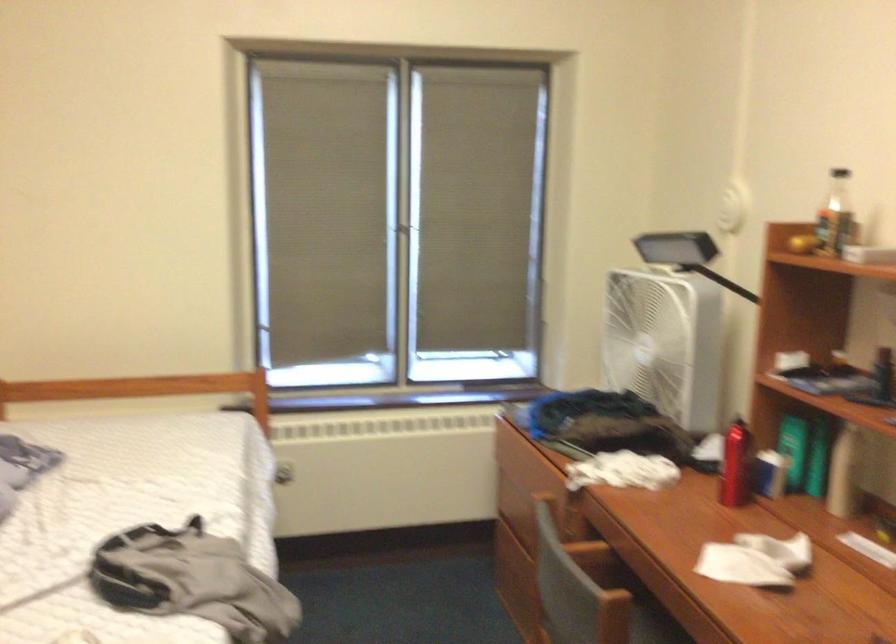
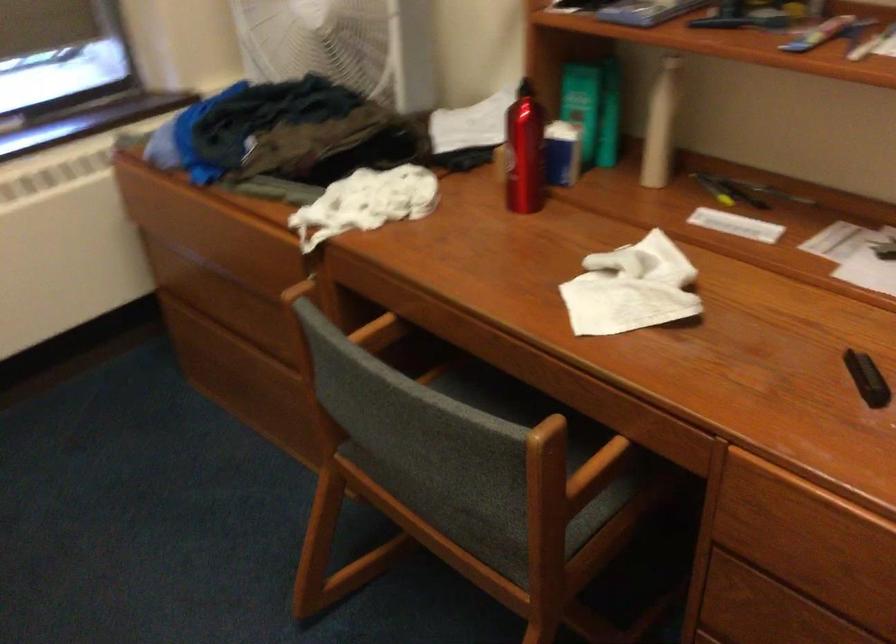
Locate, in the second image, the point that corresponds to pixel 791 442 in the first image.

(582, 104)